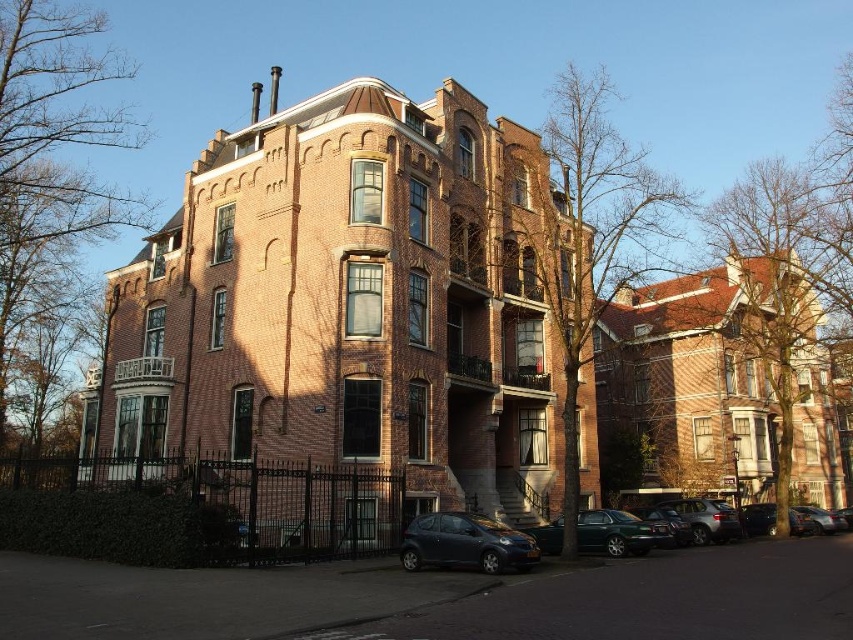
Question: Does metallic gray hatchback at lower center appear over green matte car at lower center?

Choices:
 (A) no
 (B) yes

Answer: (B)

Question: Which of the following is the farthest from the observer?

Choices:
 (A) green matte car at lower center
 (B) matte black car at lower center
 (C) metallic gray hatchback at lower center

Answer: (A)

Question: Is matte black car at lower center in front of metallic gray hatchback at lower center?

Choices:
 (A) no
 (B) yes

Answer: (A)

Question: Which object is positioned farthest from the metallic gray hatchback at lower center?

Choices:
 (A) matte black car at lower center
 (B) green matte car at lower center

Answer: (B)

Question: Does matte black car at lower center come in front of metallic gray hatchback at lower center?

Choices:
 (A) yes
 (B) no

Answer: (B)

Question: Which point is closer to the camera taking this photo?

Choices:
 (A) (511, 560)
 (B) (490, 557)

Answer: (A)